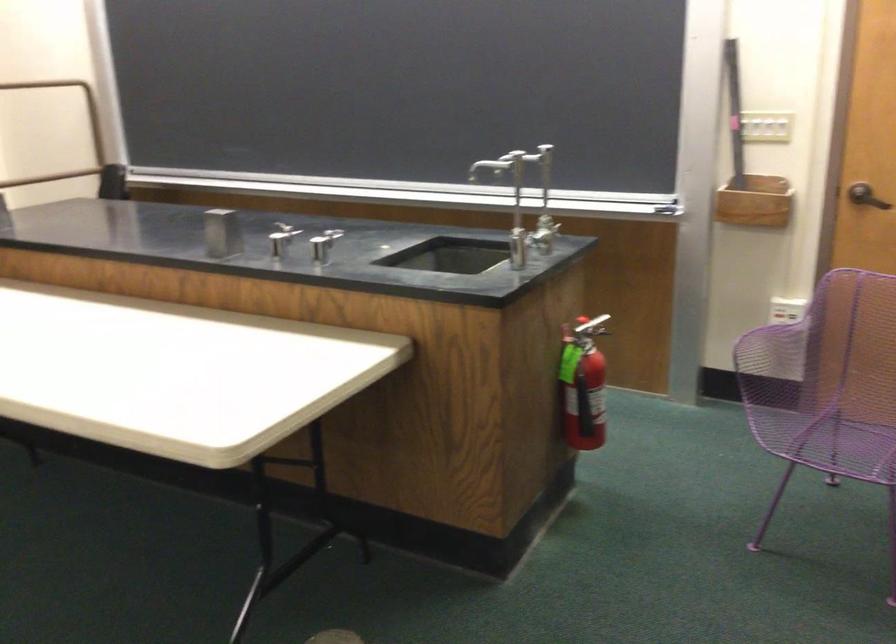
The height and width of the screenshot is (644, 896). In order to click on chair sitting surface in this screenshot , I will do `click(851, 415)`.